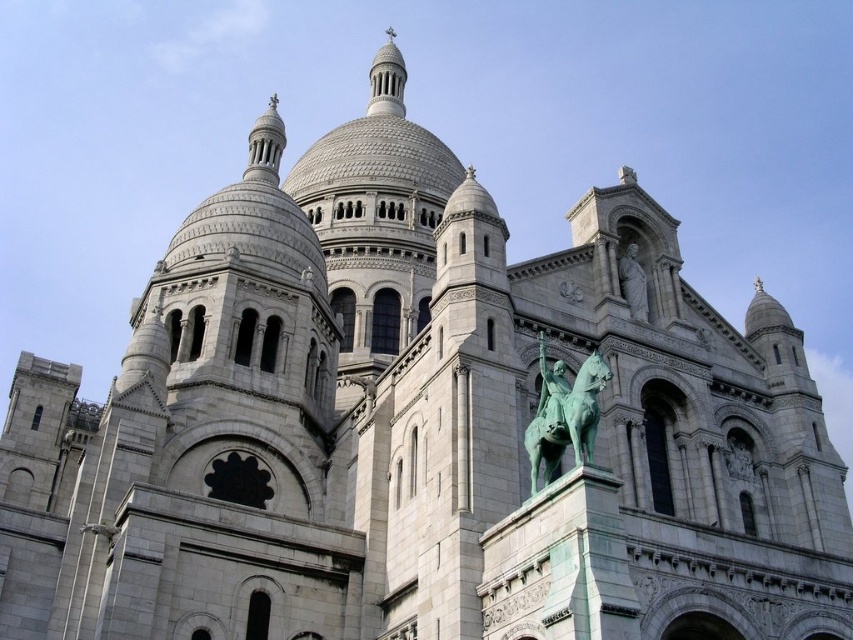
Locate an element on the screen. Image resolution: width=853 pixels, height=640 pixels. green polished bronze statue at center is located at coordinates (564, 413).

Does green polished bronze statue at center appear on the left side of green patina statue at upper right?

Correct, you'll find green polished bronze statue at center to the left of green patina statue at upper right.

Does point (560, 452) lie in front of point (641, 276)?

Yes, point (560, 452) is in front of point (641, 276).

Identify the location of green polished bronze statue at center. (564, 413).